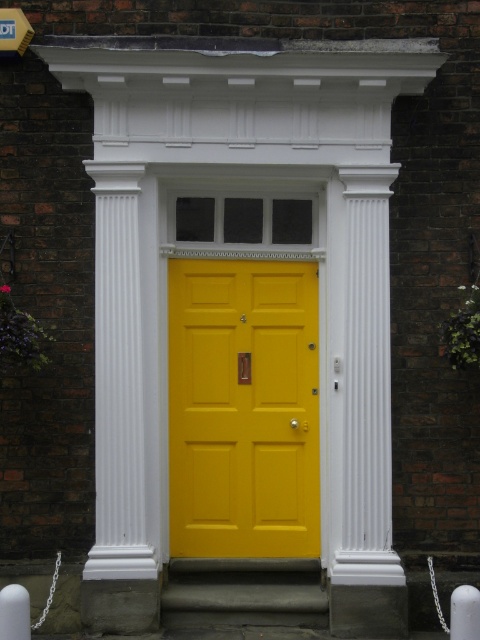
You are standing in front of the building and want to locate the point at coordinates (242,408). According to the scene description, where exactly is this point located?

The point at coordinates (242,408) is on the matte yellow door at center.

You are a delivery person approaching the building and need to park your vehicle. The parking spot is marked by the concrete at center. Can you determine if the parking spot is large enough to accommodate your vehicle if the vehicle is the same size as the metallic yellow street sign at upper left?

The concrete at center is bigger than the metallic yellow street sign at upper left, so yes, the parking spot marked by the concrete at center can accommodate a vehicle the size of the metallic yellow street sign at upper left.

You are an architect designing a new building and want to ensure the matte yellow door at center aligns with the proportions of the concrete at center. Based on the image, which object has a greater width?

The concrete at center has a greater width than the matte yellow door at center, as the matte yellow door at center is narrower.